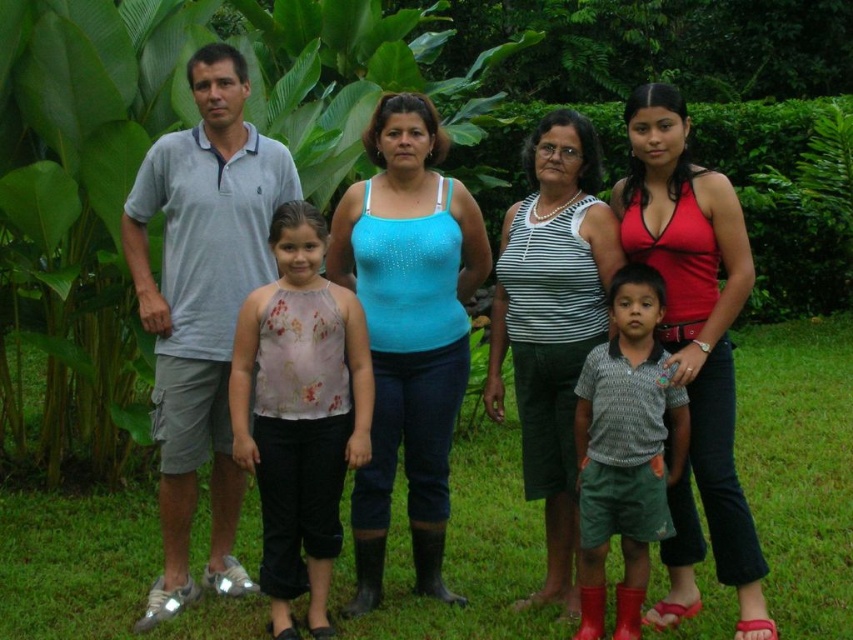
Is gray cotton polo shirt at left smaller than striped tank top at center?

No.

Between gray cotton polo shirt at left and striped tank top at center, which one appears on the right side from the viewer's perspective?

striped tank top at center

At what (x,y) coordinates should I click in order to perform the action: click on gray cotton polo shirt at left. Please return your answer as a coordinate pair (x, y). Looking at the image, I should click on (202, 305).

Can you confirm if green grass at center is positioned to the left of blue sparkly tank top at center?

In fact, green grass at center is to the right of blue sparkly tank top at center.

The image size is (853, 640). I want to click on green grass at center, so click(799, 468).

Between point (518, 483) and point (451, 314), which one is positioned behind?

The point (518, 483) is behind.

Find the location of a particular element. This screenshot has height=640, width=853. green grass at center is located at coordinates (799, 468).

Does green grass at center appear on the right side of textured gray shirt at center?

Yes, green grass at center is to the right of textured gray shirt at center.

The height and width of the screenshot is (640, 853). What are the coordinates of `green grass at center` in the screenshot? It's located at point(799,468).